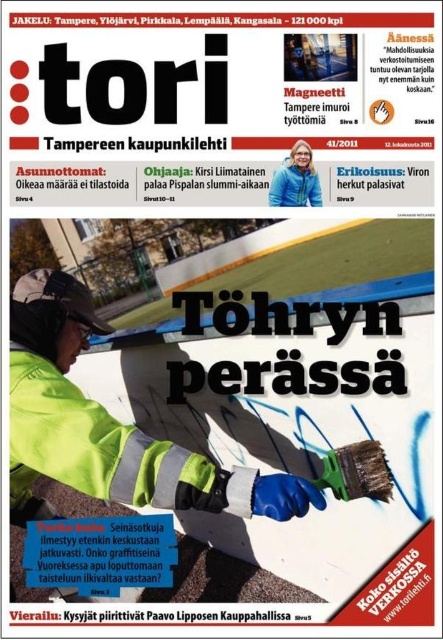
Can you confirm if green fabric jacket at center is positioned to the right of green metallic brush at center?

No, green fabric jacket at center is not to the right of green metallic brush at center.

Can you confirm if green fabric jacket at center is wider than green metallic brush at center?

Yes, green fabric jacket at center is wider than green metallic brush at center.

Image resolution: width=443 pixels, height=640 pixels. Find the location of `green fabric jacket at center`. green fabric jacket at center is located at coordinates (108, 426).